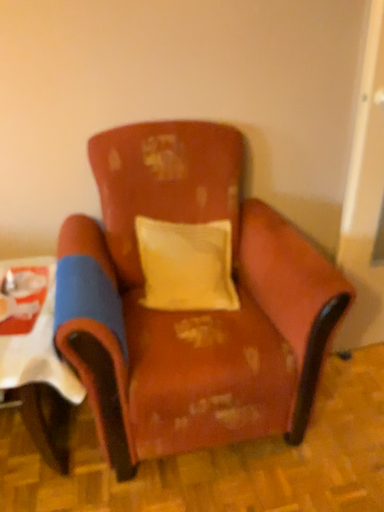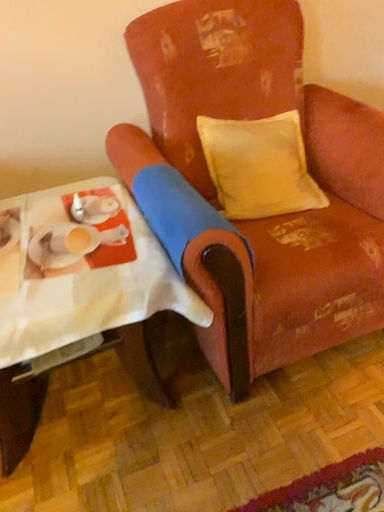
Question: Which way did the camera rotate in the video?

Choices:
 (A) rotated right
 (B) rotated left

Answer: (A)